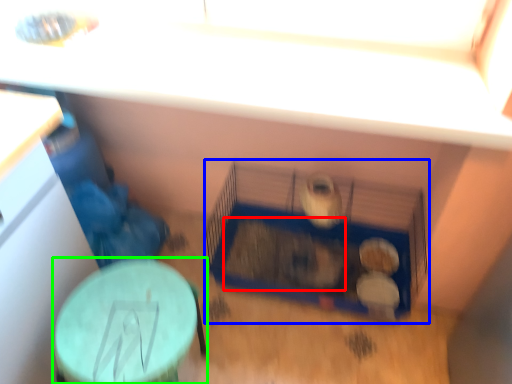
Question: Which object is positioned farthest from animal (highlighted by a red box)? Select from bird cage (highlighted by a blue box) and table (highlighted by a green box).

Choices:
 (A) bird cage
 (B) table

Answer: (B)